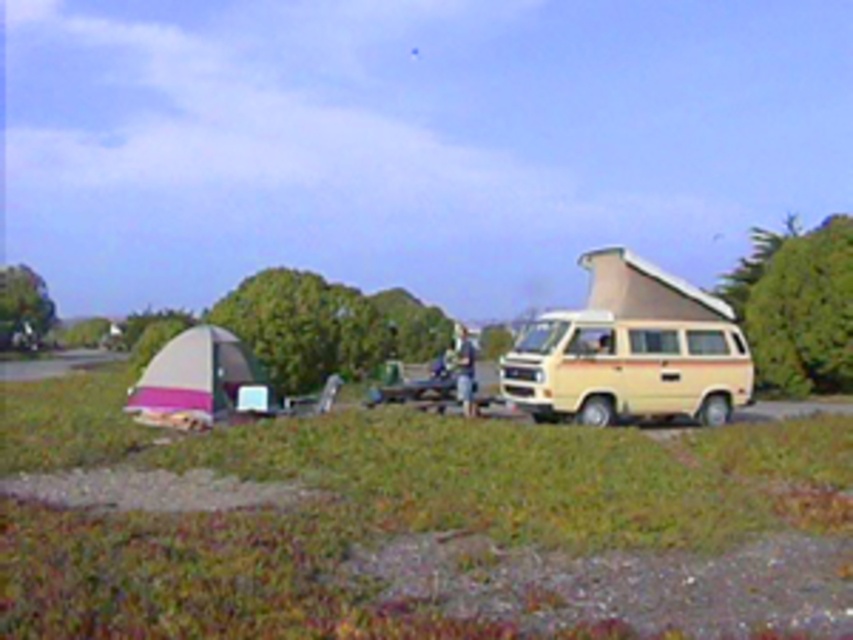
You are standing in the campsite and want to know which object is shorter between the green grass at center and the light blue denim jeans at center. Can you tell me?

The green grass at center is shorter than the light blue denim jeans at center.

You are standing at the campsite and want to take a photo of the two points marked in the scene. Which point, point (596, 352) or point (461, 385), will appear larger in your camera view?

Point (596, 352) is closer to the camera than point (461, 385), so it will appear larger in the photo.

You are standing at the point marked as point [585,324] in the image. If you walk straight ahead, will you eventually reach the beige camper van with its roof popped up?

The distance of point [585,324] from viewer is 70.16 feet, so if you walk straight ahead from point [585,324], you will eventually reach the beige camper van with its roof popped up since it is the closest object in that direction.